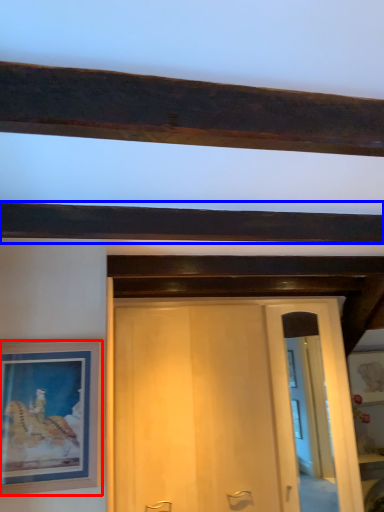
Question: Which of the following is the closest to the observer, picture frame (highlighted by a red box) or plank (highlighted by a blue box)?

Choices:
 (A) picture frame
 (B) plank

Answer: (B)